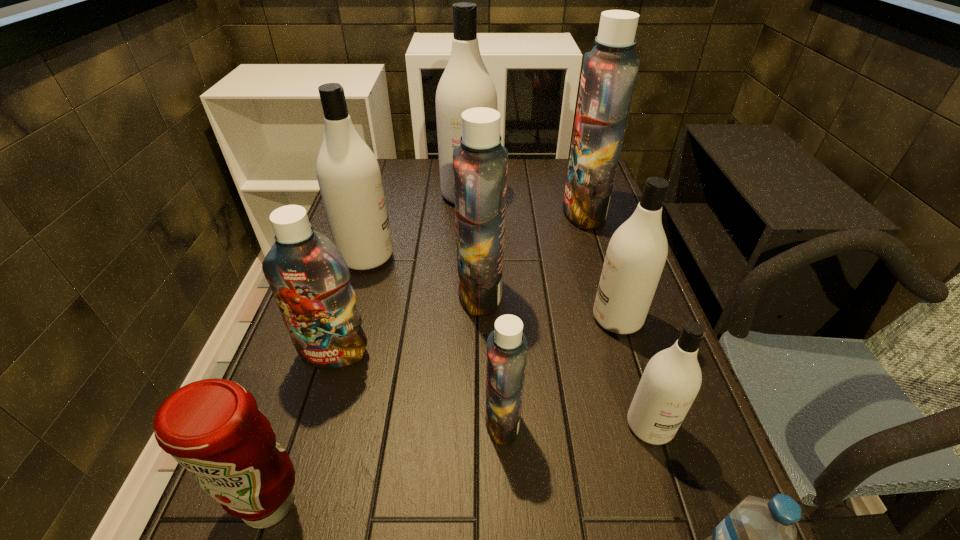
What are the coordinates of `free space located 0.050m on the front-facing side of the nearest white shampoo` in the screenshot? It's located at (665, 476).

At what (x,y) coordinates should I click in order to perform the action: click on condiment at the left edge. Please return your answer as a coordinate pair (x, y). The image size is (960, 540). Looking at the image, I should click on (212, 427).

Locate an element on the screen. The height and width of the screenshot is (540, 960). object that is at the far right corner is located at coordinates (610, 69).

Identify the location of free space at the far edge of the desktop. Image resolution: width=960 pixels, height=540 pixels. (511, 184).

In the image, there is a desktop. At what (x,y) coordinates should I click in order to perform the action: click on free space at the left edge. Please return your answer as a coordinate pair (x, y). This screenshot has height=540, width=960. Looking at the image, I should click on (323, 480).

Locate an element on the screen. vacant space at the right edge is located at coordinates pos(618,403).

The width and height of the screenshot is (960, 540). Identify the location of vacant space at the far left corner of the desktop. (387, 159).

I want to click on free spot at the far right corner of the desktop, so point(562,162).

Locate an element on the screen. vacant area that lies between the second nearest object and the third biggest white shampoo is located at coordinates (444, 410).

Identify the location of free spot between the red condiment and the biggest blue shampoo. This screenshot has width=960, height=540. (427, 357).